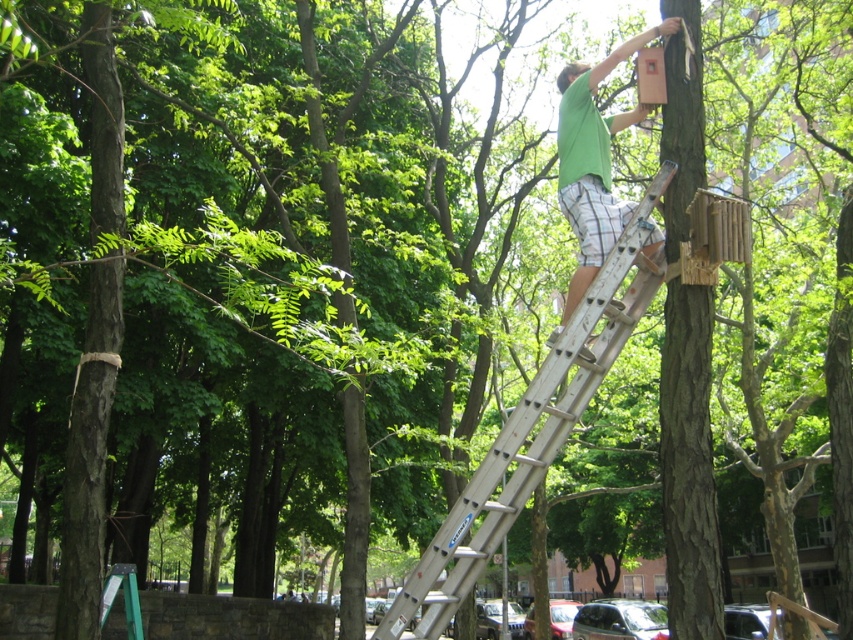
Question: Is white metallic ladder at upper center below green matte shirt at upper right?

Choices:
 (A) yes
 (B) no

Answer: (A)

Question: Is white metallic ladder at upper center above green matte shirt at upper right?

Choices:
 (A) no
 (B) yes

Answer: (A)

Question: Among these objects, which one is farthest from the camera?

Choices:
 (A) green matte shirt at upper right
 (B) white metallic ladder at upper center

Answer: (B)

Question: Can you confirm if white metallic ladder at upper center is smaller than green matte shirt at upper right?

Choices:
 (A) no
 (B) yes

Answer: (B)